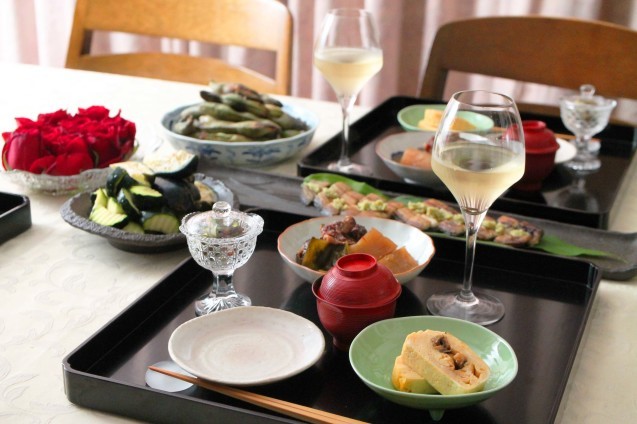
You are a GUI agent. You are given a task and a screenshot of the screen. Output one action in this format:
    pyautogui.click(x=<x>, y=<y>)
    Task: Click on the green bowls
    The width and height of the screenshot is (637, 424).
    Given the screenshot: What is the action you would take?
    pyautogui.click(x=490, y=343), pyautogui.click(x=409, y=114)